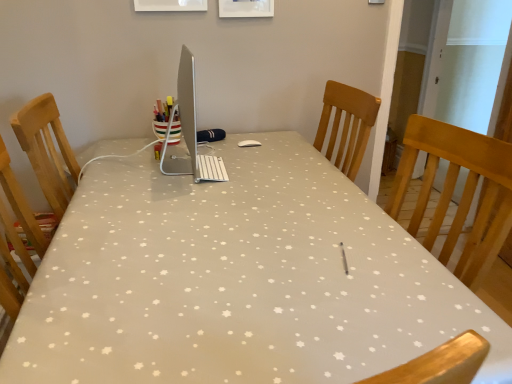
Question: From a real-world perspective, is sleek silver desktop at center physically below white fabric table at center?

Choices:
 (A) no
 (B) yes

Answer: (A)

Question: Considering the relative sizes of sleek silver desktop at center and white fabric table at center in the image provided, is sleek silver desktop at center smaller than white fabric table at center?

Choices:
 (A) no
 (B) yes

Answer: (B)

Question: Can you confirm if sleek silver desktop at center is thinner than white fabric table at center?

Choices:
 (A) no
 (B) yes

Answer: (B)

Question: Is sleek silver desktop at center not inside white fabric table at center?

Choices:
 (A) yes
 (B) no

Answer: (A)

Question: Can you confirm if sleek silver desktop at center is taller than white fabric table at center?

Choices:
 (A) yes
 (B) no

Answer: (B)

Question: Could you tell me if sleek silver desktop at center is facing white fabric table at center?

Choices:
 (A) no
 (B) yes

Answer: (A)

Question: Is white fabric table at center not inside sleek silver desktop at center?

Choices:
 (A) no
 (B) yes

Answer: (B)

Question: Can you confirm if white fabric table at center is taller than sleek silver desktop at center?

Choices:
 (A) yes
 (B) no

Answer: (A)

Question: Is white fabric table at center closer to the viewer compared to sleek silver desktop at center?

Choices:
 (A) no
 (B) yes

Answer: (B)

Question: Is sleek silver desktop at center at the back of white fabric table at center?

Choices:
 (A) no
 (B) yes

Answer: (A)

Question: From the image's perspective, is white fabric table at center under sleek silver desktop at center?

Choices:
 (A) no
 (B) yes

Answer: (B)

Question: Can you confirm if white fabric table at center is smaller than sleek silver desktop at center?

Choices:
 (A) no
 (B) yes

Answer: (A)

Question: Is white fabric table at center taller or shorter than sleek silver desktop at center?

Choices:
 (A) tall
 (B) short

Answer: (A)